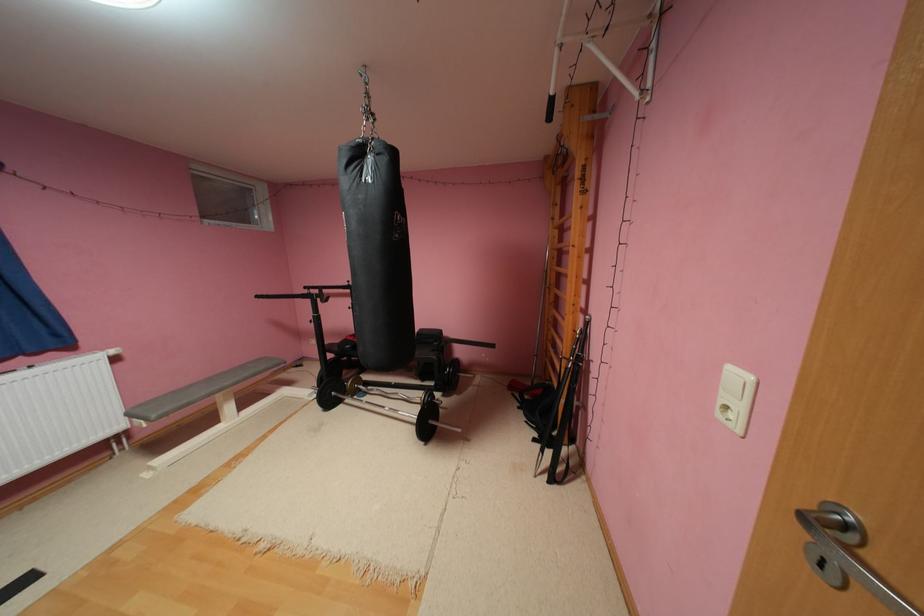
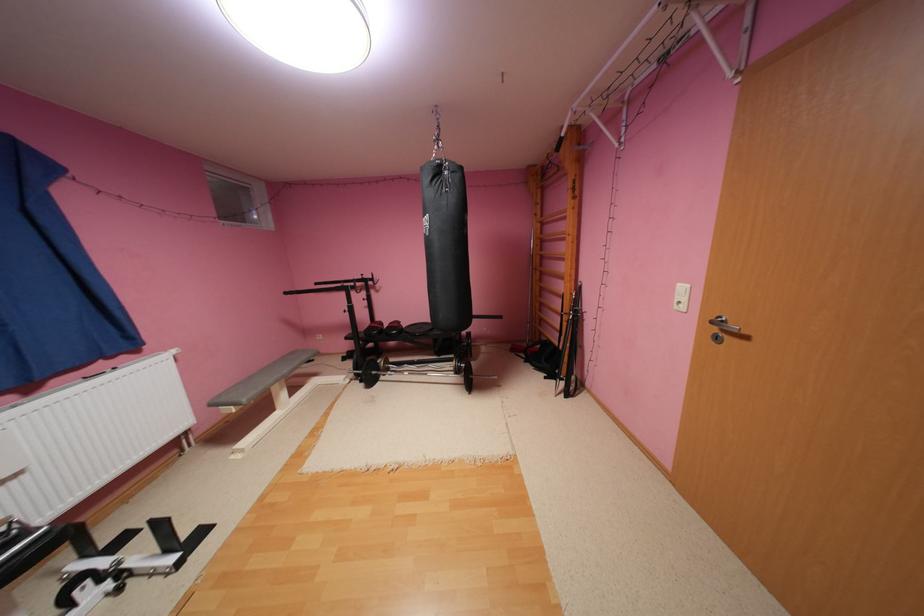
The point at (543, 440) is marked in the first image. Where is the corresponding point in the second image?

(554, 378)